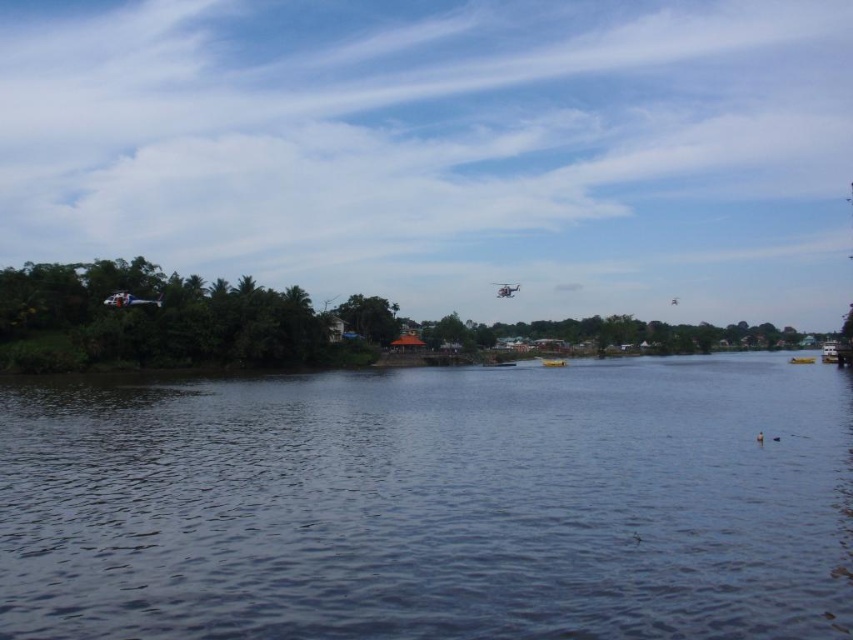
Is point (610, 467) more distant than point (563, 358)?

No, it is in front of (563, 358).

Which is in front, point (604, 401) or point (547, 358)?

Point (604, 401) is in front.

In order to click on dark blue water at center in this screenshot , I will do `click(434, 504)`.

Is dark blue water at center positioned behind yellow matte boat at lower right?

No.

This screenshot has height=640, width=853. Describe the element at coordinates (434, 504) in the screenshot. I see `dark blue water at center` at that location.

Does point (676, 621) come closer to viewer compared to point (793, 358)?

Yes, it is.

At what (x,y) coordinates should I click in order to perform the action: click on dark blue water at center. Please return your answer as a coordinate pair (x, y). The height and width of the screenshot is (640, 853). Looking at the image, I should click on (434, 504).

Can you confirm if yellow matte boat at center is wider than yellow matte boat at lower right?

Incorrect, yellow matte boat at center's width does not surpass yellow matte boat at lower right's.

Does yellow matte boat at center lie in front of yellow matte boat at lower right?

That is True.

Which is behind, point (552, 362) or point (788, 362)?

Positioned behind is point (788, 362).

Where is `yellow matte boat at center`? The height and width of the screenshot is (640, 853). yellow matte boat at center is located at coordinates (553, 362).